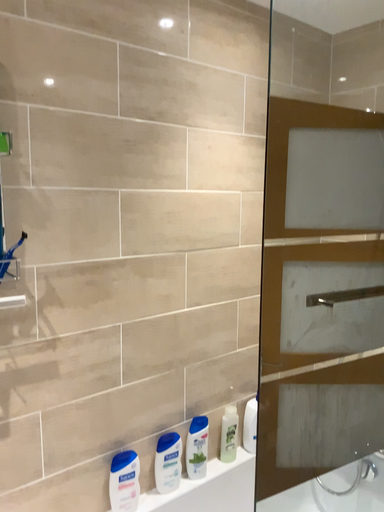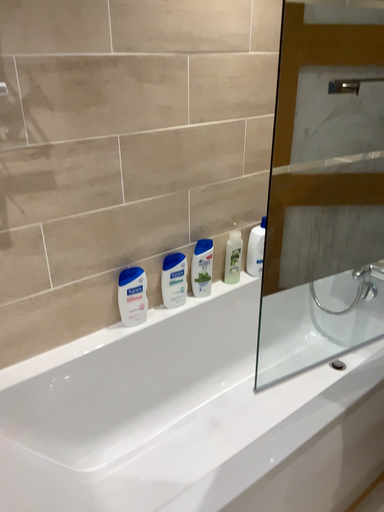
Question: Which way did the camera rotate in the video?

Choices:
 (A) rotated upward
 (B) rotated downward

Answer: (B)